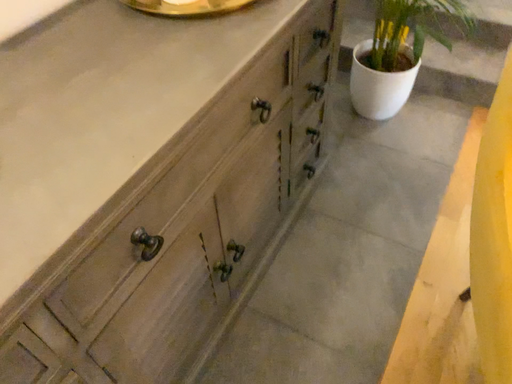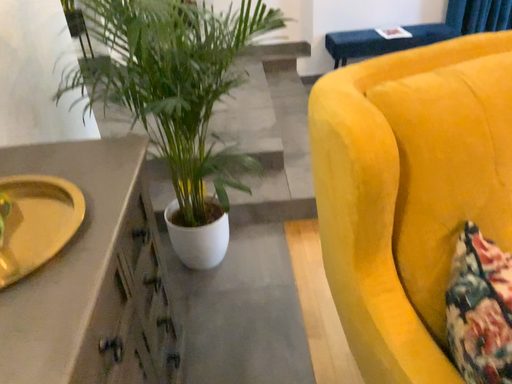
Question: How did the camera likely rotate when shooting the video?

Choices:
 (A) rotated upward
 (B) rotated downward

Answer: (A)